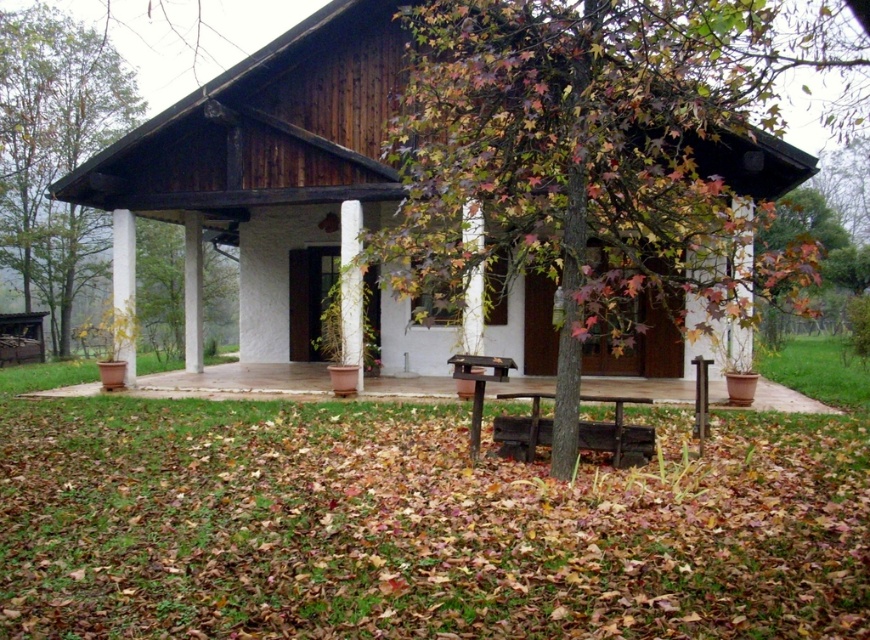
You are standing on the grassy lawn in front of the house and want to walk to the smooth concrete porch at center. Which direction should you walk relative to the dark brown wooden picnic table at center?

You should walk to the left of the dark brown wooden picnic table at center because the smooth concrete porch at center is located to the left of it.

You are planning to place a new flower bed between the green leafy tree at left and the brown wooden park bench at center. If the flower bed requires a minimum of 30 meters of space, will there be enough room?

The distance between the green leafy tree at left and the brown wooden park bench at center is 26.88 meters, which is less than the required 30 meters. Therefore, there is not enough space for the flower bed.

You are standing in front of the house and want to take a photo that includes both the point at coordinates point [271,394] and point [529,433]. Which point should you focus on first to ensure both are in focus?

You should focus on the point at coordinates point [271,394] first because it is closer to the camera than point [529,433]. This ensures that both points will be within the depth of field when taking the photo.